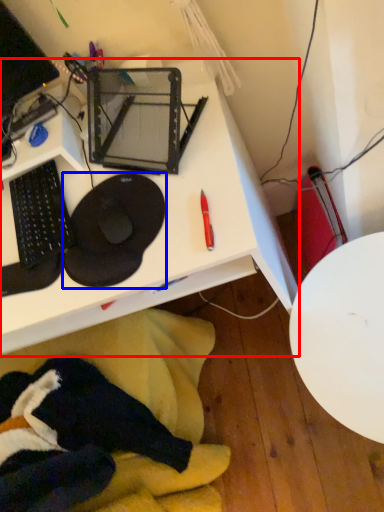
Question: Which object is closer to the camera taking this photo, desk (highlighted by a red box) or sit (highlighted by a blue box)?

Choices:
 (A) desk
 (B) sit

Answer: (A)